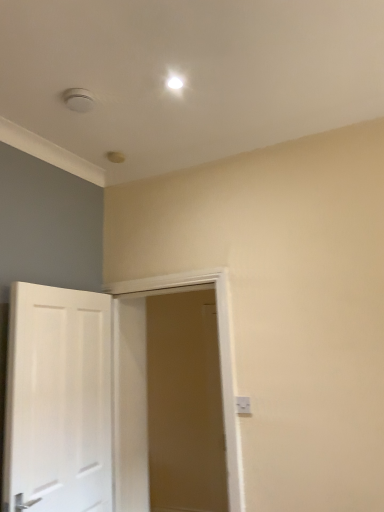
Measure the distance between white glossy door at left, arranged as the first door when viewed from the left, and camera.

The depth of white glossy door at left, arranged as the first door when viewed from the left, is 6.22 feet.

Where is `white glossy door at left, arranged as the first door when viewed from the left`? white glossy door at left, arranged as the first door when viewed from the left is located at coordinates (58, 400).

What do you see at coordinates (243, 405) in the screenshot? I see `white plastic electric outlet at lower right` at bounding box center [243, 405].

The height and width of the screenshot is (512, 384). Describe the element at coordinates (133, 396) in the screenshot. I see `white wooden door at center, which is the 2th door in left-to-right order` at that location.

Find the location of a particular element. The height and width of the screenshot is (512, 384). white glossy door at left, arranged as the first door when viewed from the left is located at coordinates (58, 400).

Is white plastic electric outlet at lower right not near white wooden door at center, which is the 2th door in left-to-right order?

Absolutely, white plastic electric outlet at lower right is distant from white wooden door at center, which is the 2th door in left-to-right order.

Is white plastic electric outlet at lower right taller or shorter than white wooden door at center, which is the 2th door in left-to-right order?

white plastic electric outlet at lower right is shorter than white wooden door at center, which is the 2th door in left-to-right order.

Is white plastic electric outlet at lower right to the right of white wooden door at center, which is the 2th door in left-to-right order, from the viewer's perspective?

Yes.

Is white plastic electric outlet at lower right oriented away from white wooden door at center, which is the 2th door in left-to-right order?

No, white plastic electric outlet at lower right's orientation is not away from white wooden door at center, which is the 2th door in left-to-right order.

Is white wooden door at center, which is the 2th door in left-to-right order, facing towards white glossy door at left, the 2th door viewed from the right?

Yes, white wooden door at center, which is the 2th door in left-to-right order, is turned towards white glossy door at left, the 2th door viewed from the right.

How much distance is there between white wooden door at center, which is the first door in right-to-left order, and white glossy door at left, arranged as the first door when viewed from the left?

white wooden door at center, which is the first door in right-to-left order, and white glossy door at left, arranged as the first door when viewed from the left, are 21.66 inches apart.

Can you see white wooden door at center, which is the 2th door in left-to-right order, touching white glossy door at left, arranged as the first door when viewed from the left?

No, white wooden door at center, which is the 2th door in left-to-right order, is not in contact with white glossy door at left, arranged as the first door when viewed from the left.

Considering their positions, is white wooden door at center, which is the first door in right-to-left order, located in front of or behind white glossy door at left, arranged as the first door when viewed from the left?

white wooden door at center, which is the first door in right-to-left order, is behind white glossy door at left, arranged as the first door when viewed from the left.

Does white wooden door at center, which is the first door in right-to-left order, lie in front of white plastic electric outlet at lower right?

Yes, white wooden door at center, which is the first door in right-to-left order, is in front of white plastic electric outlet at lower right.

Where is `the 1st door in front of the white plastic electric outlet at lower right`? the 1st door in front of the white plastic electric outlet at lower right is located at coordinates (133, 396).

From a real-world perspective, which is physically below, white wooden door at center, which is the 2th door in left-to-right order, or white plastic electric outlet at lower right?

white plastic electric outlet at lower right.

Is white glossy door at left, the 2th door viewed from the right, looking in the opposite direction of white plastic electric outlet at lower right?

No, white glossy door at left, the 2th door viewed from the right, is not facing the opposite direction of white plastic electric outlet at lower right.

Is white glossy door at left, the 2th door viewed from the right, taller or shorter than white plastic electric outlet at lower right?

In the image, white glossy door at left, the 2th door viewed from the right, appears to be taller than white plastic electric outlet at lower right.

Relative to white plastic electric outlet at lower right, is white glossy door at left, the 2th door viewed from the right, in front or behind?

white glossy door at left, the 2th door viewed from the right, is positioned closer to the viewer than white plastic electric outlet at lower right.

Does white glossy door at left, arranged as the first door when viewed from the left, have a greater width compared to white plastic electric outlet at lower right?

Correct, the width of white glossy door at left, arranged as the first door when viewed from the left, exceeds that of white plastic electric outlet at lower right.

Does point (246, 404) come in front of point (40, 440)?

No.

Consider the image. Relative to white glossy door at left, the 2th door viewed from the right, is white plastic electric outlet at lower right in front or behind?

Clearly, white plastic electric outlet at lower right is behind white glossy door at left, the 2th door viewed from the right.

Locate an element on the screen. This screenshot has height=512, width=384. electric outlet behind the white glossy door at left, the 2th door viewed from the right is located at coordinates (243, 405).

Is white glossy door at left, the 2th door viewed from the right, positioned beyond the bounds of white wooden door at center, which is the 2th door in left-to-right order?

white glossy door at left, the 2th door viewed from the right, is positioned outside white wooden door at center, which is the 2th door in left-to-right order.

Locate an element on the screen. Image resolution: width=384 pixels, height=512 pixels. door that appears behind the white glossy door at left, the 2th door viewed from the right is located at coordinates (133, 396).

Considering the relative sizes of white glossy door at left, the 2th door viewed from the right, and white wooden door at center, which is the first door in right-to-left order, in the image provided, is white glossy door at left, the 2th door viewed from the right, shorter than white wooden door at center, which is the first door in right-to-left order,?

Correct, white glossy door at left, the 2th door viewed from the right, is not as tall as white wooden door at center, which is the first door in right-to-left order.

From the image's perspective, between white glossy door at left, the 2th door viewed from the right, and white wooden door at center, which is the first door in right-to-left order, who is located below?

white wooden door at center, which is the first door in right-to-left order.

Find the location of `the 1st door to the left of the white plastic electric outlet at lower right, counting from the anchor's position`. the 1st door to the left of the white plastic electric outlet at lower right, counting from the anchor's position is located at coordinates (133, 396).

The image size is (384, 512). I want to click on door that appears below the white wooden door at center, which is the 2th door in left-to-right order (from a real-world perspective), so click(58, 400).

Estimate the real-world distances between objects in this image. Which object is closer to white glossy door at left, the 2th door viewed from the right, white plastic electric outlet at lower right or white wooden door at center, which is the 2th door in left-to-right order?

white wooden door at center, which is the 2th door in left-to-right order, is closer to white glossy door at left, the 2th door viewed from the right.

Consider the image. Looking at the image, which one is located further to white wooden door at center, which is the first door in right-to-left order, white plastic electric outlet at lower right or white glossy door at left, arranged as the first door when viewed from the left?

white plastic electric outlet at lower right lies further to white wooden door at center, which is the first door in right-to-left order, than the other object.

Considering their positions, is white wooden door at center, which is the 2th door in left-to-right order, positioned closer to white plastic electric outlet at lower right than white glossy door at left, the 2th door viewed from the right?

white glossy door at left, the 2th door viewed from the right, is closer to white plastic electric outlet at lower right.

Considering their positions, is white glossy door at left, arranged as the first door when viewed from the left, positioned further to white wooden door at center, which is the first door in right-to-left order, than white plastic electric outlet at lower right?

white plastic electric outlet at lower right is further to white wooden door at center, which is the first door in right-to-left order.

Based on their spatial positions, is white wooden door at center, which is the first door in right-to-left order, or white plastic electric outlet at lower right closer to white glossy door at left, arranged as the first door when viewed from the left?

Among the two, white wooden door at center, which is the first door in right-to-left order, is located nearer to white glossy door at left, arranged as the first door when viewed from the left.

Based on their spatial positions, is white glossy door at left, the 2th door viewed from the right, or white wooden door at center, which is the first door in right-to-left order, closer to white plastic electric outlet at lower right?

white glossy door at left, the 2th door viewed from the right, is closer to white plastic electric outlet at lower right.

I want to click on door between white glossy door at left, the 2th door viewed from the right, and white plastic electric outlet at lower right from left to right, so click(133, 396).